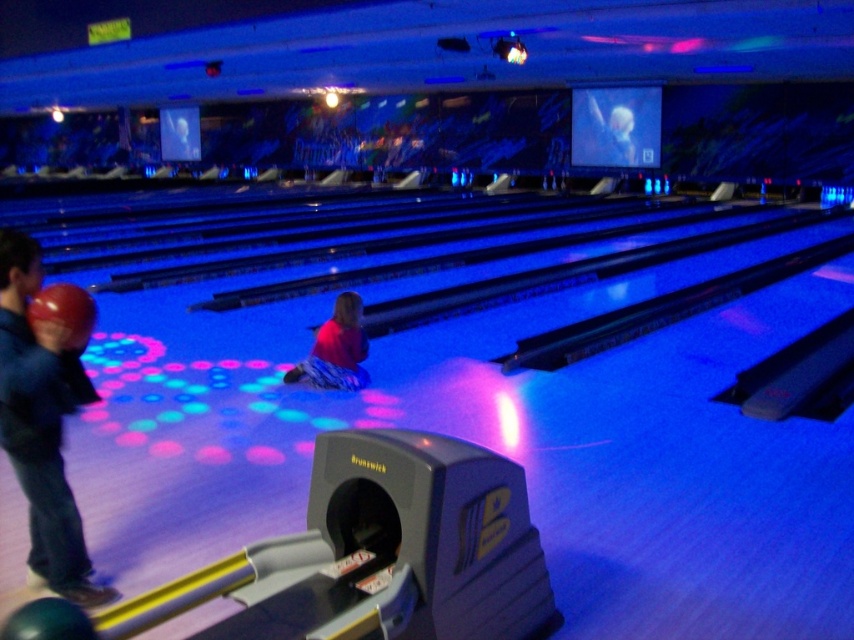
The width and height of the screenshot is (854, 640). Describe the element at coordinates (41, 426) in the screenshot. I see `blue denim jeans at lower left` at that location.

Image resolution: width=854 pixels, height=640 pixels. I want to click on blue denim jeans at lower left, so click(41, 426).